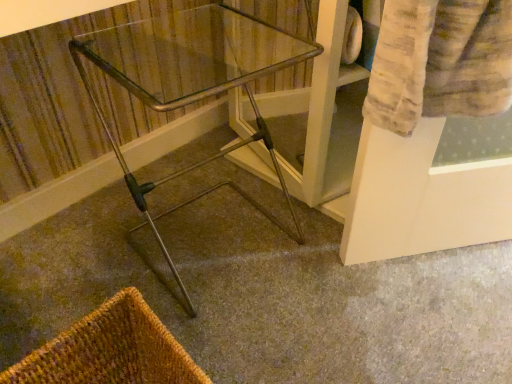
This screenshot has width=512, height=384. I want to click on free space behind clear glass table at center, so click(233, 162).